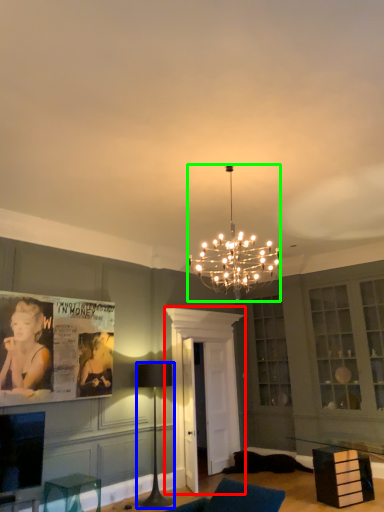
Question: Which is farther away from glass door (highlighted by a red box)? lamp (highlighted by a blue box) or lamp (highlighted by a green box)?

Choices:
 (A) lamp
 (B) lamp

Answer: (B)